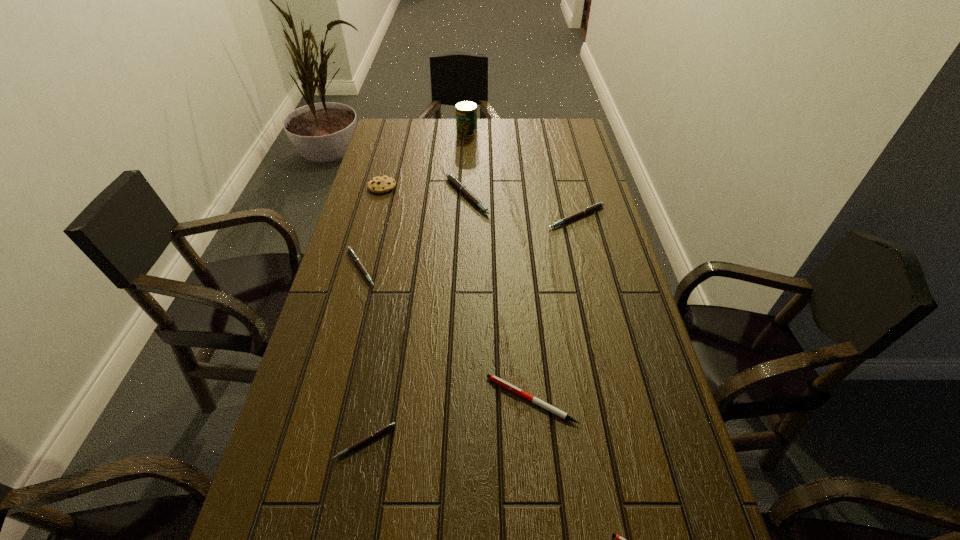
Where is `the tallest object`? the tallest object is located at coordinates (x=466, y=111).

Image resolution: width=960 pixels, height=540 pixels. In order to click on can in this screenshot , I will do `click(466, 111)`.

Identify the location of the seventh shortest object. (380, 184).

You are a GUI agent. You are given a task and a screenshot of the screen. Output one action in this format:
    pyautogui.click(x=<x>, y=<y>)
    Task: Click on the brown cookie
    
    Given the screenshot: What is the action you would take?
    pyautogui.click(x=380, y=184)

The image size is (960, 540). Find the location of `the second pink pen from right to left`. the second pink pen from right to left is located at coordinates (450, 177).

The image size is (960, 540). In order to click on the third tallest object in this screenshot , I will do `click(450, 177)`.

Locate an element on the screen. the fifth shortest object is located at coordinates (598, 205).

At what (x,y) coordinates should I click in order to perform the action: click on the rightmost pink pen. Please return your answer as a coordinate pair (x, y). This screenshot has height=540, width=960. Looking at the image, I should click on (598, 205).

The image size is (960, 540). I want to click on the fourth nearest object, so click(350, 250).

Locate an element on the screen. The image size is (960, 540). the second nearest pink pen is located at coordinates pos(350,250).